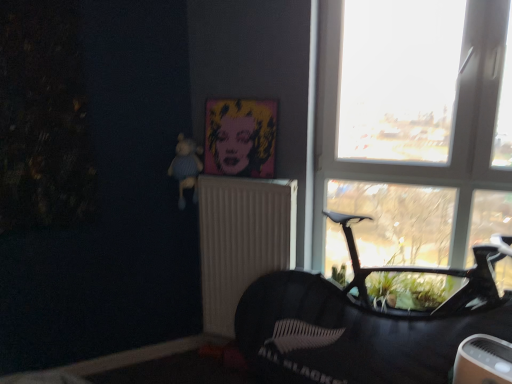
Question: Considering the positions of point (242, 155) and point (181, 170), is point (242, 155) closer or farther from the camera than point (181, 170)?

Choices:
 (A) closer
 (B) farther

Answer: (A)

Question: From the image's perspective, is pop art canvas at upper center located above or below blue knitted bear at upper left?

Choices:
 (A) above
 (B) below

Answer: (A)

Question: Based on their relative distances, which object is nearer to the white textured radiator at center?

Choices:
 (A) transparent glass window at upper right
 (B) blue knitted bear at upper left
 (C) pop art canvas at upper center

Answer: (C)

Question: Based on their relative distances, which object is farther from the transparent glass window at upper right?

Choices:
 (A) pop art canvas at upper center
 (B) blue knitted bear at upper left
 (C) white textured radiator at center

Answer: (B)